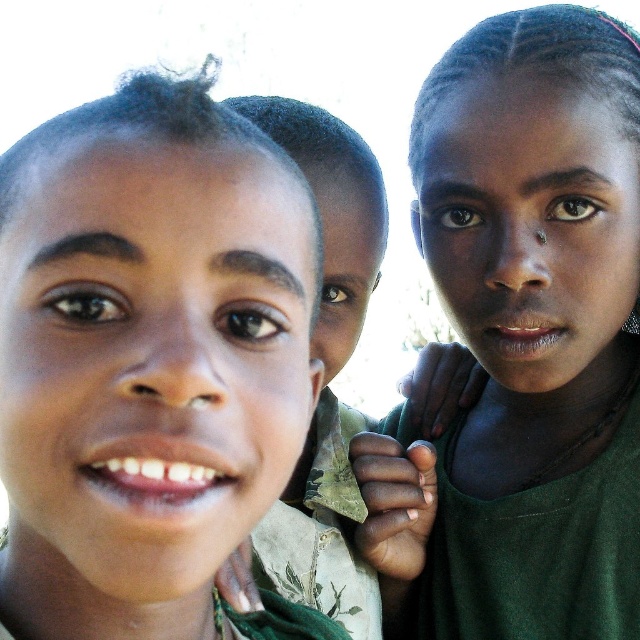
Can you confirm if matte green shirt at left is thinner than camouflage fabric shirt at center?

Incorrect, matte green shirt at left's width is not less than camouflage fabric shirt at center's.

Can you confirm if matte green shirt at left is positioned above camouflage fabric shirt at center?

Actually, matte green shirt at left is below camouflage fabric shirt at center.

Find the location of `matte green shirt at left`. matte green shirt at left is located at coordinates (148, 364).

You are a GUI agent. You are given a task and a screenshot of the screen. Output one action in this format:
    pyautogui.click(x=<x>, y=<y>)
    Task: Click on the matte green shirt at left
    
    Given the screenshot: What is the action you would take?
    pyautogui.click(x=148, y=364)

Looking at this image, does dark green fabric at upper right have a lesser width compared to camouflage fabric shirt at center?

Incorrect, dark green fabric at upper right's width is not less than camouflage fabric shirt at center's.

Looking at this image, does dark green fabric at upper right appear on the right side of camouflage fabric shirt at center?

Indeed, dark green fabric at upper right is positioned on the right side of camouflage fabric shirt at center.

The image size is (640, 640). Find the location of `dark green fabric at upper right`. dark green fabric at upper right is located at coordinates (522, 340).

Which is behind, point (252, 460) or point (564, 99)?

Point (564, 99)

Does matte green shirt at left have a lesser height compared to dark green fabric at upper right?

Yes.

Describe the element at coordinates (148, 364) in the screenshot. I see `matte green shirt at left` at that location.

Where is `matte green shirt at left`? matte green shirt at left is located at coordinates (148, 364).